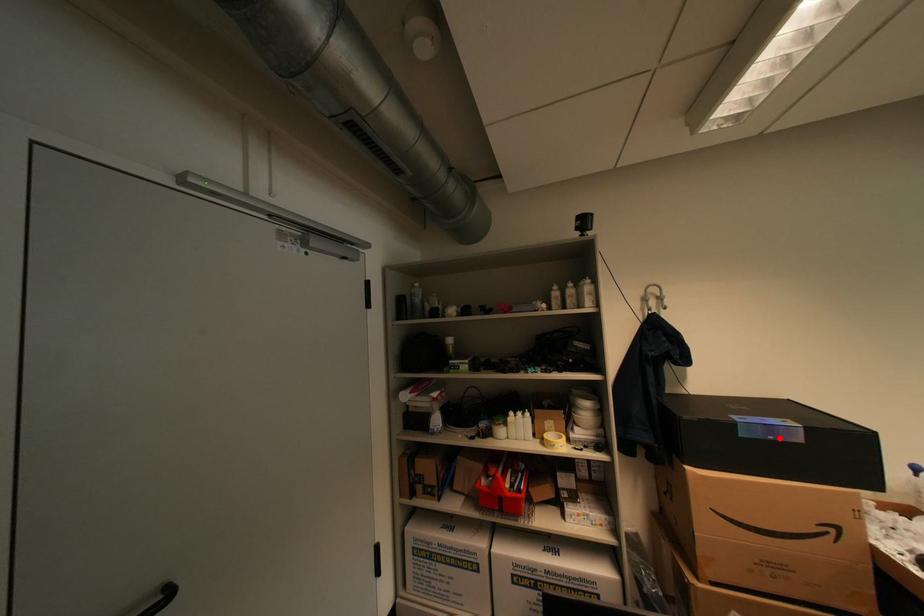
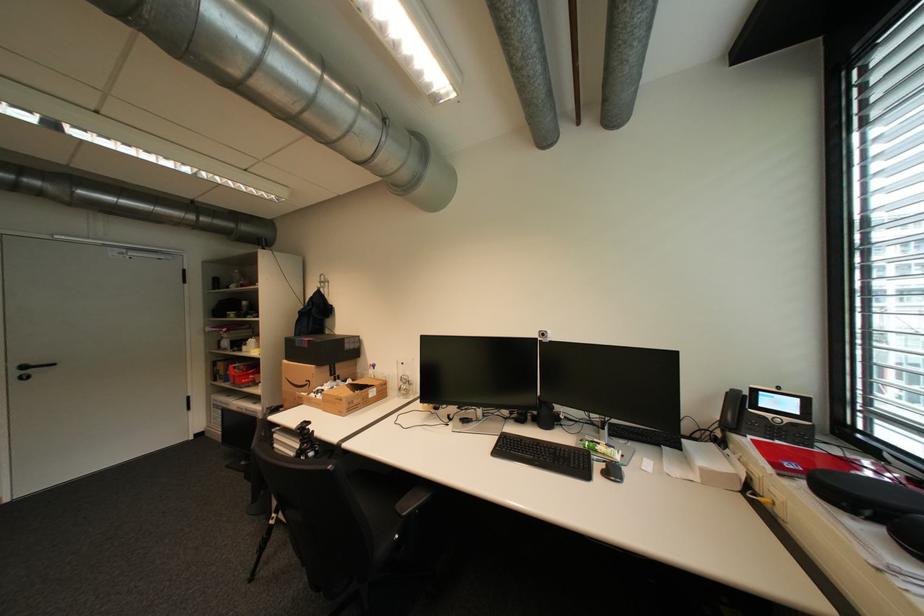
Locate, in the second image, the point that corresponds to the highlighted location in the first image.

(310, 346)